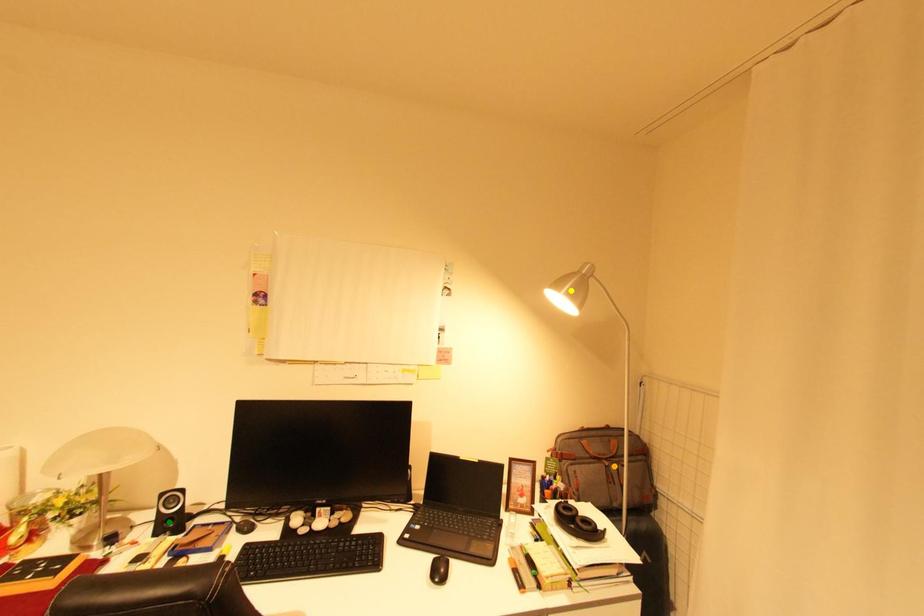
Order these from farthest to nearest:
yellow point, orange point, green point

orange point < yellow point < green point